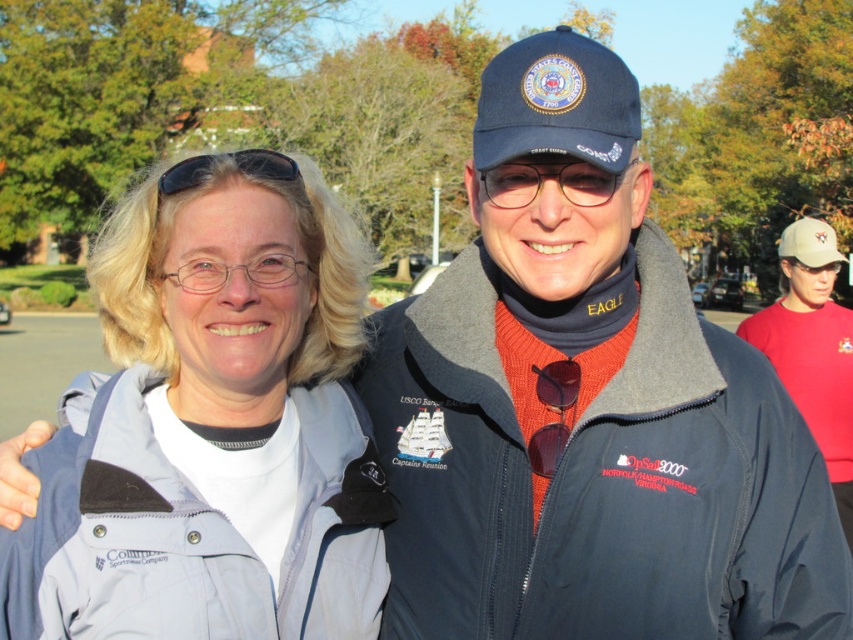
Question: Can you confirm if gray fabric jacket at left is wider than clear plastic glasses at center?

Choices:
 (A) no
 (B) yes

Answer: (B)

Question: Which of the following is the farthest from the observer?

Choices:
 (A) (575, 180)
 (B) (216, 161)
 (C) (297, 177)

Answer: (C)

Question: Is the position of clear plastic glasses at center more distant than that of black rubber goggles at upper center?

Choices:
 (A) no
 (B) yes

Answer: (A)

Question: Which point is closer to the camera taking this photo?

Choices:
 (A) (190, 173)
 (B) (498, 168)

Answer: (B)

Question: Is gray fabric jacket at left below clear plastic glasses at center?

Choices:
 (A) no
 (B) yes

Answer: (B)

Question: Which is nearer to the black rubber goggles at upper center?

Choices:
 (A) clear plastic glasses at center
 (B) gray fabric jacket at left

Answer: (B)